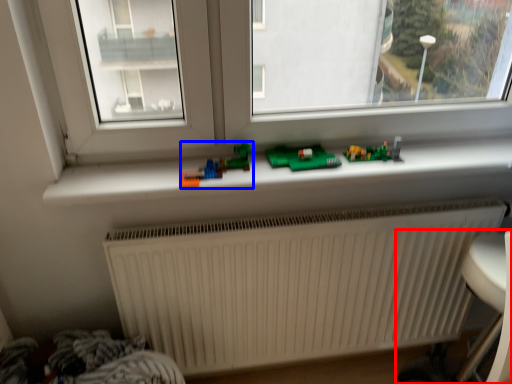
Question: Which of the following is the closest to the observer, armchair (highlighted by a red box) or toy (highlighted by a blue box)?

Choices:
 (A) armchair
 (B) toy

Answer: (A)